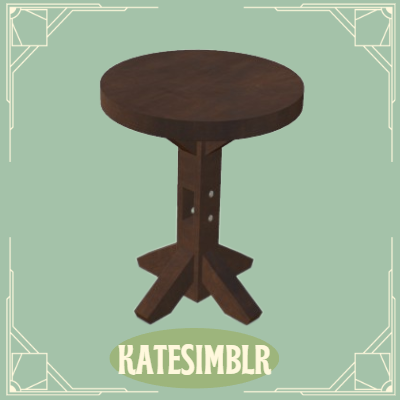
Find the location of a particular element. table is located at coordinates (199, 103).